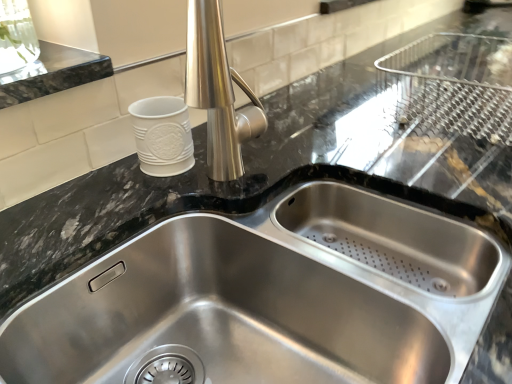
Identify the location of stainless steel sink at center. The image size is (512, 384). (219, 316).

What do you see at coordinates (219, 316) in the screenshot? I see `stainless steel sink at center` at bounding box center [219, 316].

Measure the distance between stainless steel sink at center and camera.

The distance of stainless steel sink at center from camera is 18.99 inches.

Identify the location of stainless steel sink at center. (219, 316).